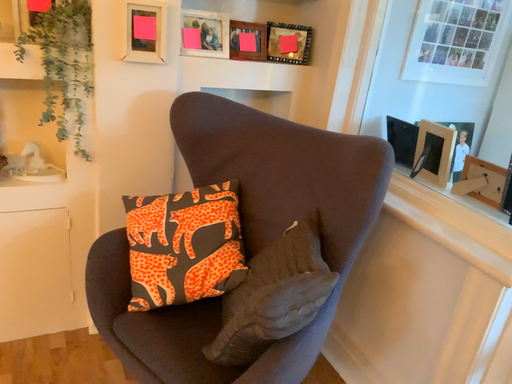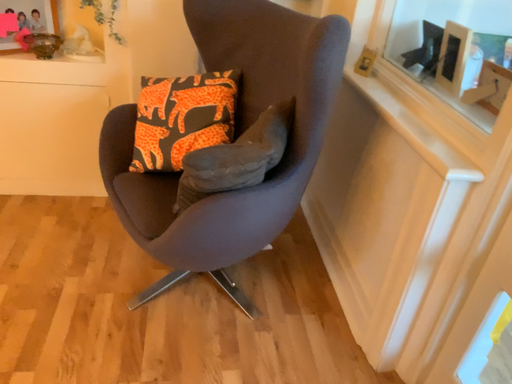
Question: Which way did the camera rotate in the video?

Choices:
 (A) rotated downward
 (B) rotated upward

Answer: (A)